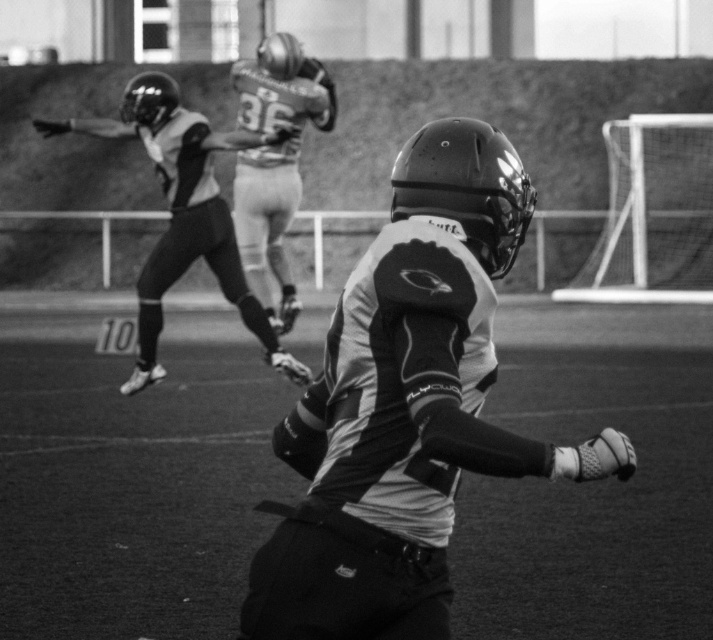
In the scene shown: Does matte black jersey at upper left have a lesser height compared to metallic silver helmet at upper center?

Answer: Indeed, matte black jersey at upper left has a lesser height compared to metallic silver helmet at upper center.

Is point (276, 337) positioned behind point (262, 58)?

No, it is in front of (262, 58).

At what (x,y) coordinates should I click in order to perform the action: click on matte black jersey at upper left. Please return your answer as a coordinate pair (x, y). Image resolution: width=713 pixels, height=640 pixels. Looking at the image, I should click on (183, 212).

Between matte black helmet at center and metallic silver helmet at upper center, which one is positioned higher?

metallic silver helmet at upper center is above.

Locate an element on the screen. This screenshot has width=713, height=640. matte black helmet at center is located at coordinates (406, 406).

Does matte black helmet at center have a lesser height compared to matte black jersey at upper left?

Yes.

Is matte black helmet at center positioned in front of matte black jersey at upper left?

Yes.

Locate an element on the screen. The image size is (713, 640). matte black helmet at center is located at coordinates (406, 406).

Find the location of a particular element. The height and width of the screenshot is (640, 713). matte black helmet at center is located at coordinates (406, 406).